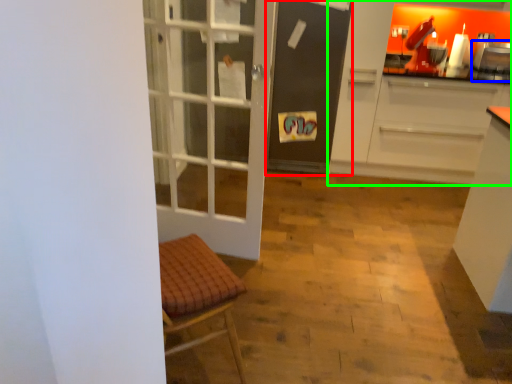
Question: Considering the real-world distances, which object is farthest from screen door (highlighted by a red box)? appliance (highlighted by a blue box) or cabinetry (highlighted by a green box)?

Choices:
 (A) appliance
 (B) cabinetry

Answer: (A)